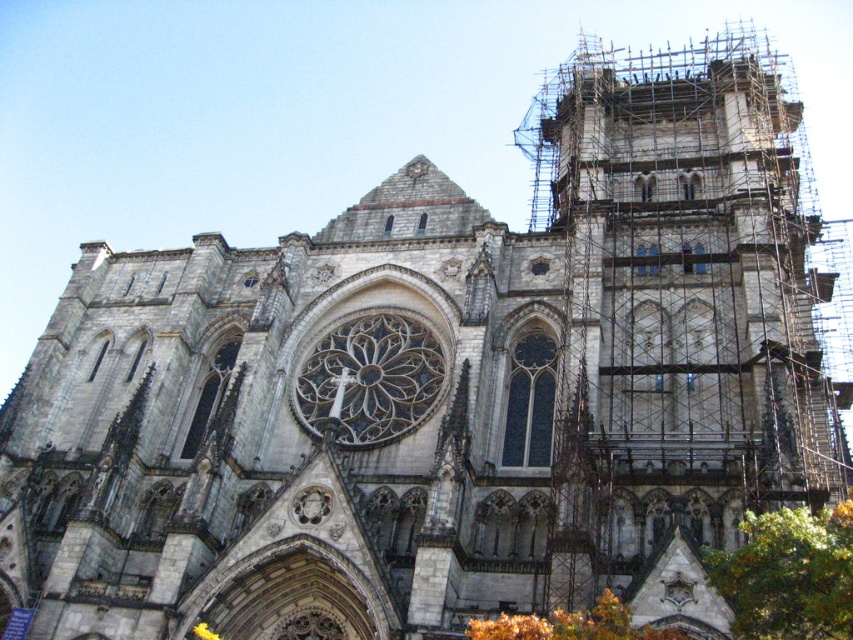
You are standing in front of the cathedral and want to take a photo of both the green leafy tree at lower right and the orange leafy tree at lower right. Since the trees are at the same location, which one would you need to focus on more to ensure both are in the frame?

The green leafy tree at lower right is larger than the orange leafy tree at lower right, so you should focus on the larger one to ensure both are in the frame.